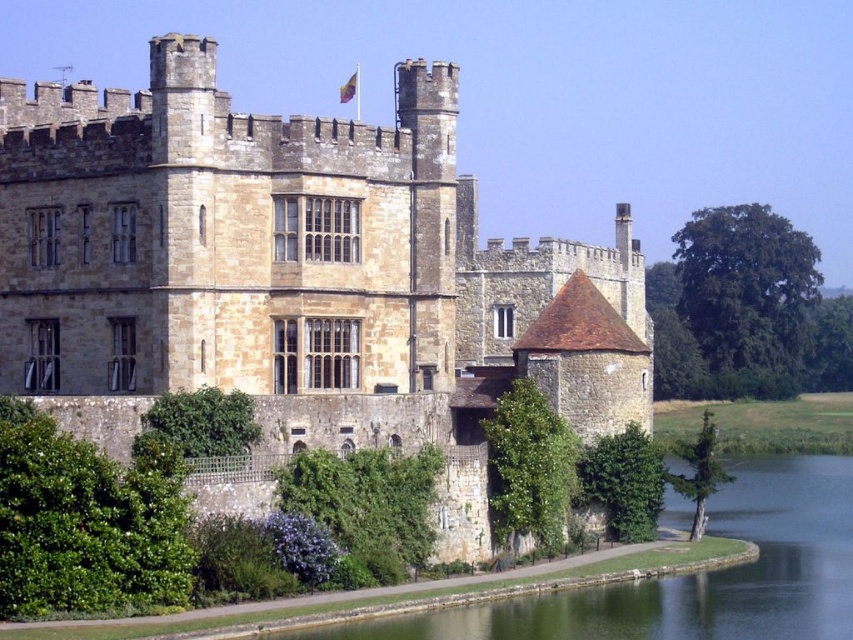
Can you confirm if brown stone castle at center is shorter than green grassy bank at lower center?

No.

Does brown stone castle at center have a larger size compared to green grassy bank at lower center?

Indeed, brown stone castle at center has a larger size compared to green grassy bank at lower center.

The image size is (853, 640). Find the location of `brown stone castle at center`. brown stone castle at center is located at coordinates (294, 275).

Where is `brown stone castle at center`? brown stone castle at center is located at coordinates (294, 275).